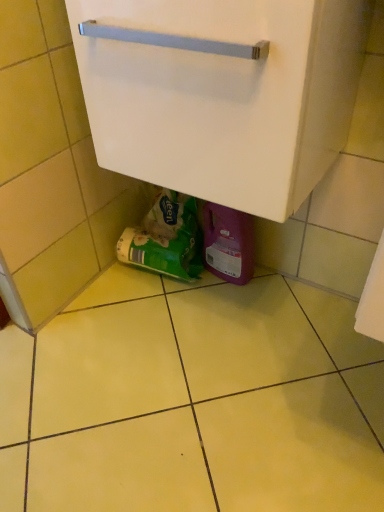
Question: Considering the positions of point (273, 41) and point (152, 239), is point (273, 41) closer or farther from the camera than point (152, 239)?

Choices:
 (A) farther
 (B) closer

Answer: (B)

Question: From the image's perspective, relative to green matte plastic bag at lower center, is white matte cabinet at center above or below?

Choices:
 (A) above
 (B) below

Answer: (A)

Question: In terms of size, does white matte cabinet at center appear bigger or smaller than green matte plastic bag at lower center?

Choices:
 (A) big
 (B) small

Answer: (A)

Question: From a real-world perspective, relative to white matte cabinet at center, is green matte plastic bag at lower center vertically above or below?

Choices:
 (A) below
 (B) above

Answer: (A)

Question: Visually, is green matte plastic bag at lower center positioned to the left or to the right of white matte cabinet at center?

Choices:
 (A) left
 (B) right

Answer: (A)

Question: Considering the positions of green matte plastic bag at lower center and white matte cabinet at center in the image, is green matte plastic bag at lower center bigger or smaller than white matte cabinet at center?

Choices:
 (A) small
 (B) big

Answer: (A)

Question: From their relative heights in the image, would you say green matte plastic bag at lower center is taller or shorter than white matte cabinet at center?

Choices:
 (A) short
 (B) tall

Answer: (A)